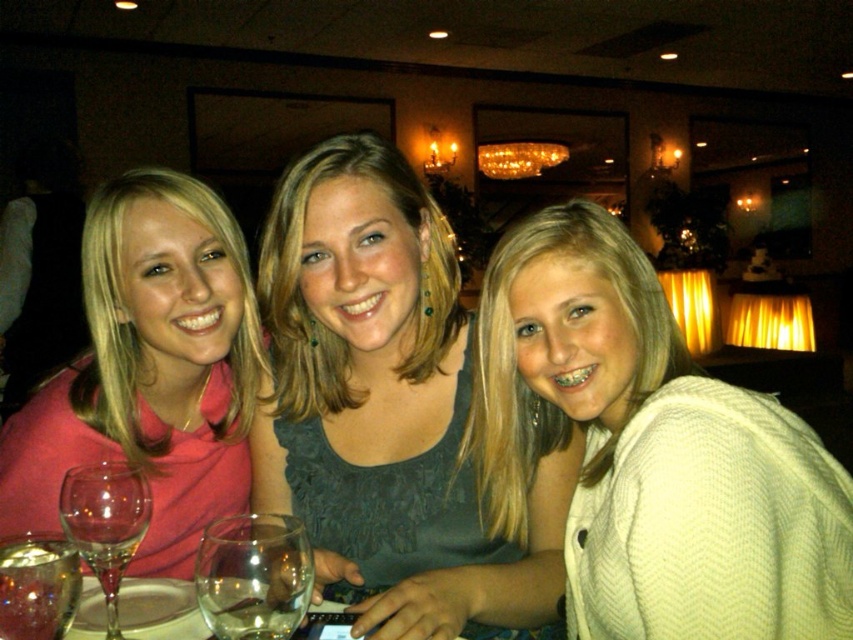
You are a photographer trying to capture a group photo of the white knitted sweater at center and the dark gray fabric dress at center. Since you want to ensure both are visible, which object should you focus on to avoid blurring due to their size difference?

The white knitted sweater at center occupies less space than the dark gray fabric dress at center, so you should focus on the dark gray fabric dress at center to ensure both are in focus as it is larger and more prominent.

You are standing at the entrance of the restaurant and see the three people in the scene. The person wearing the matte pink shirt at left is at point (x=149, y=371). If you want to greet them, which direction should you walk to reach the matte pink shirt at left?

The matte pink shirt at left is located at point (x=149, y=371), so you should walk towards that coordinate to reach them.